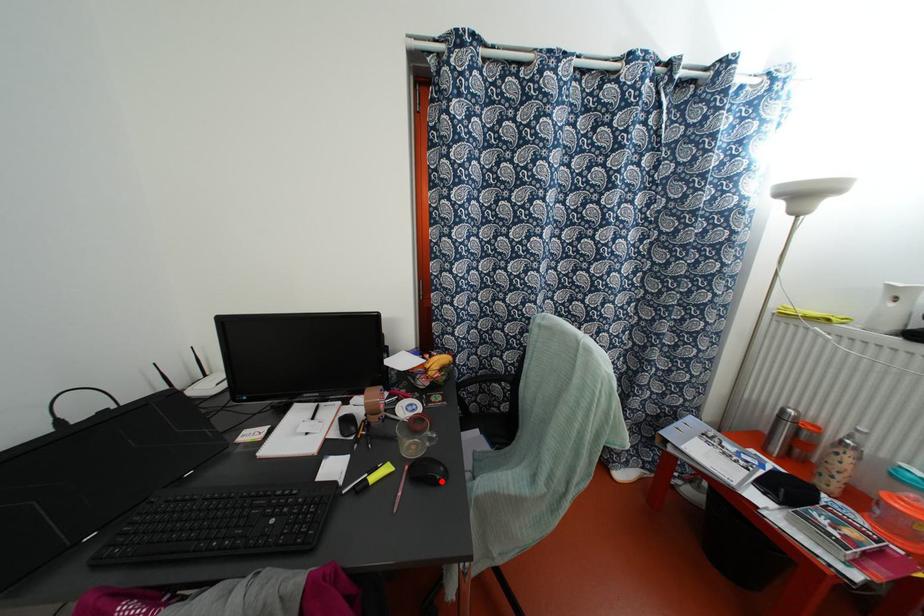
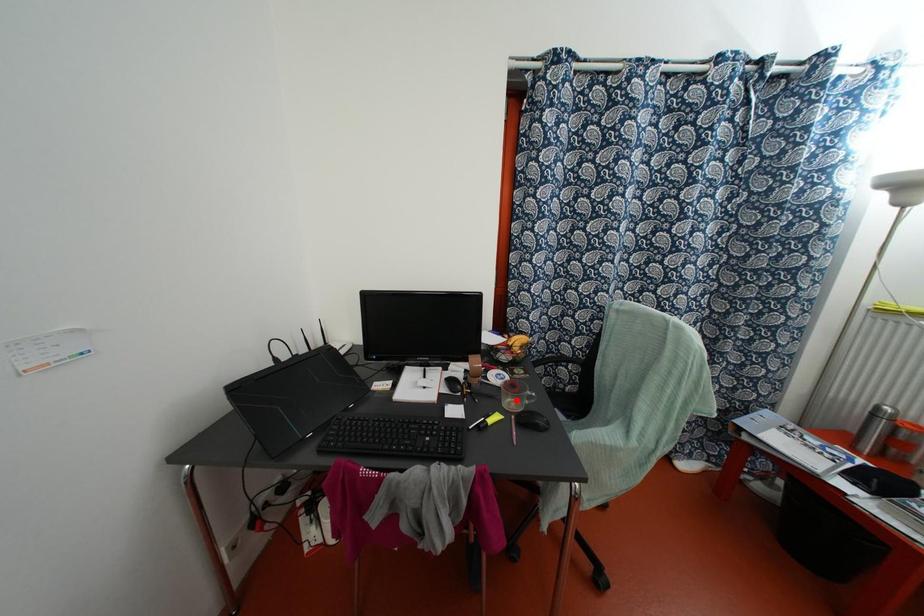
I am providing you with two images of the same scene from different viewpoints. A red point is marked on the first image and another point is marked on the second image. Do the highlighted points in image1 and image2 indicate the same real-world spot?

No